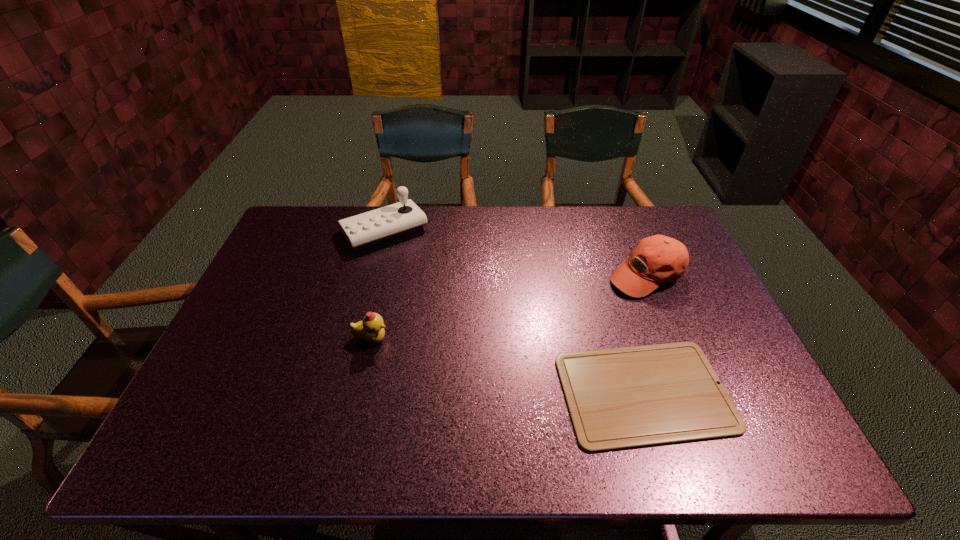
Select which object appears as the second closest to the joystick. Please provide its 2D coordinates. Your answer should be formatted as a tuple, i.e. [(x, y)], where the tuple contains the x and y coordinates of a point satisfying the conditions above.

[(621, 398)]

The height and width of the screenshot is (540, 960). I want to click on vacant position in the image that satisfies the following two spatial constraints: 1. on the front-facing side of the duckling; 2. on the right side of the shortest object, so click(359, 393).

You are a GUI agent. You are given a task and a screenshot of the screen. Output one action in this format:
    pyautogui.click(x=<x>, y=<y>)
    Task: Click on the vacant position in the image that satisfies the following two spatial constraints: 1. on the front-facing side of the shortest object; 2. on the left side of the duckling
    The image size is (960, 540).
    Given the screenshot: What is the action you would take?
    (x=359, y=393)

Where is `vacant area in the image that satisfies the following two spatial constraints: 1. on the front-facing side of the third tallest object; 2. on the back side of the shortest object`? This screenshot has width=960, height=540. vacant area in the image that satisfies the following two spatial constraints: 1. on the front-facing side of the third tallest object; 2. on the back side of the shortest object is located at coordinates (359, 393).

Find the location of a particular element. This screenshot has height=540, width=960. vacant area that satisfies the following two spatial constraints: 1. on the front-facing side of the second shortest object; 2. on the back side of the chopping board is located at coordinates (359, 393).

Locate an element on the screen. vacant space that satisfies the following two spatial constraints: 1. on the front-facing side of the third tallest object; 2. on the left side of the shortest object is located at coordinates (359, 393).

The height and width of the screenshot is (540, 960). Find the location of `blank area in the image that satisfies the following two spatial constraints: 1. on the front-facing side of the third tallest object; 2. on the back side of the chopping board`. blank area in the image that satisfies the following two spatial constraints: 1. on the front-facing side of the third tallest object; 2. on the back side of the chopping board is located at coordinates (359, 393).

Locate an element on the screen. The image size is (960, 540). vacant area in the image that satisfies the following two spatial constraints: 1. on the front side of the baseball cap; 2. on the front-facing side of the duckling is located at coordinates (672, 339).